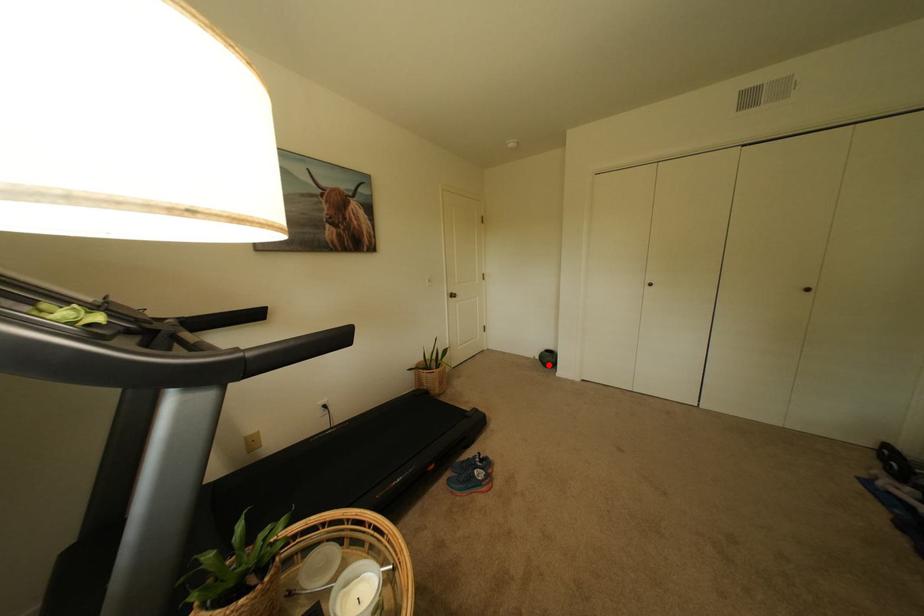
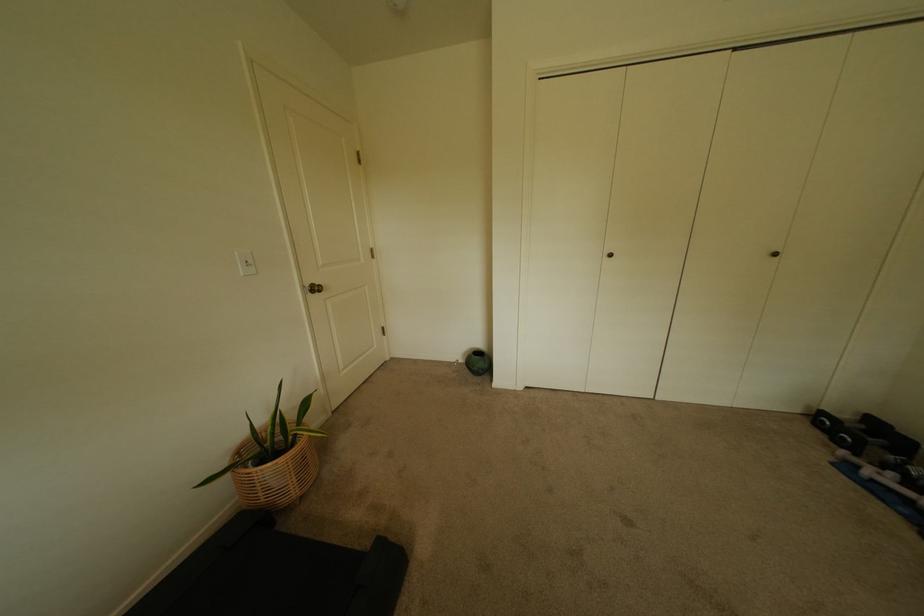
Where in the second image is the point corresponding to the highlighted location from the first image?

(476, 371)